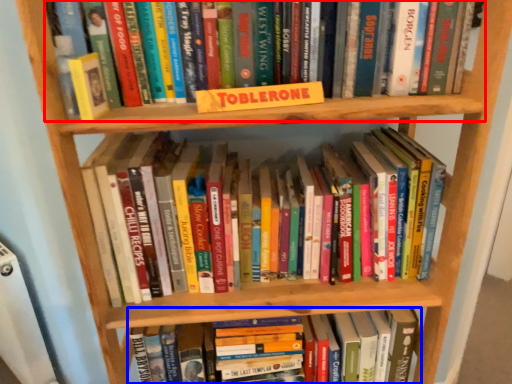
Question: Among these objects, which one is nearest to the camera, book (highlighted by a red box) or book (highlighted by a blue box)?

Choices:
 (A) book
 (B) book

Answer: (A)